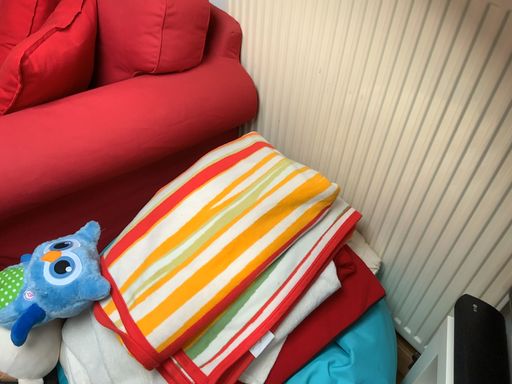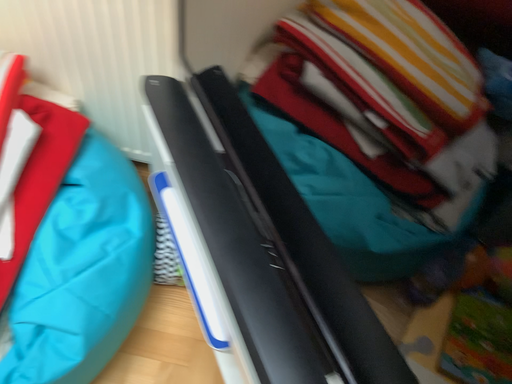
Question: How did the camera likely rotate when shooting the video?

Choices:
 (A) rotated left
 (B) rotated right

Answer: (B)